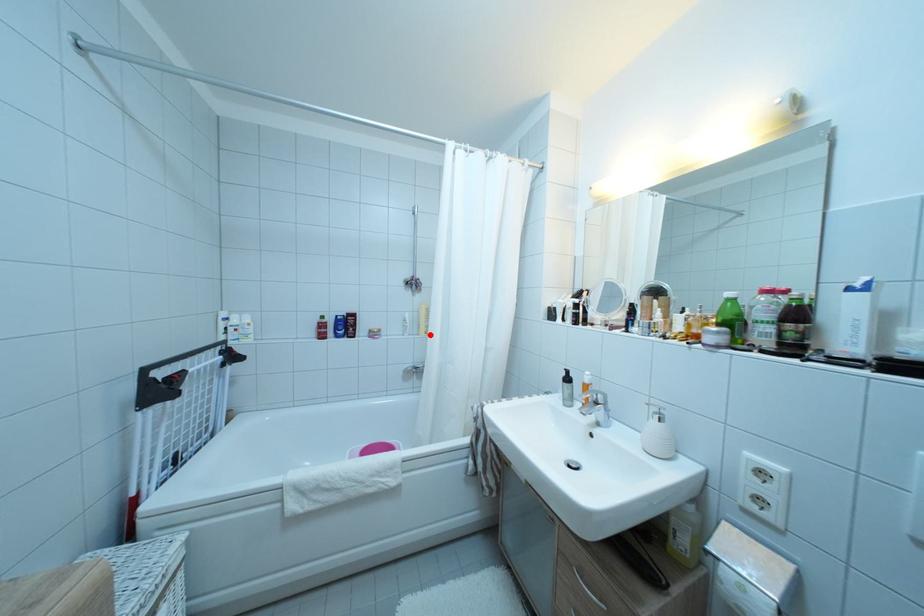
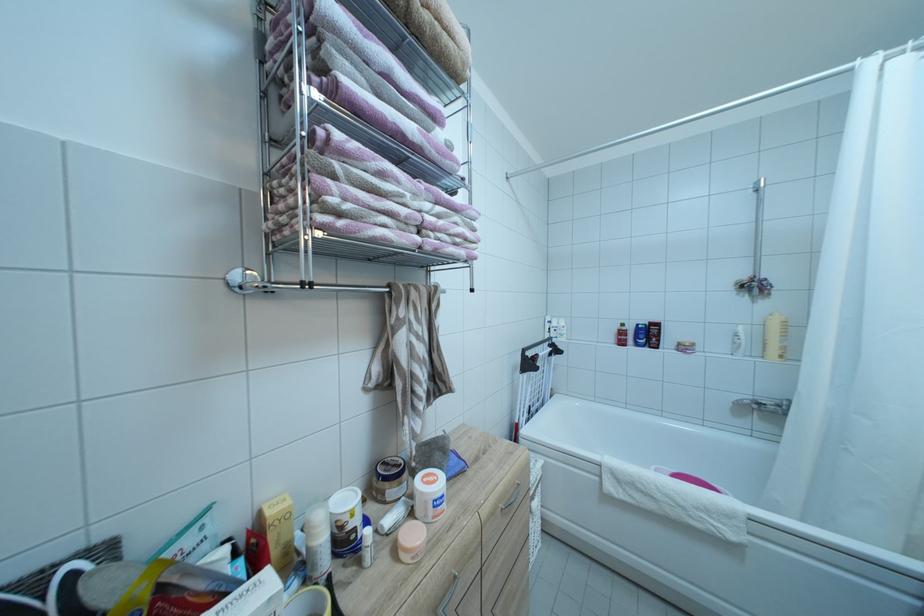
In the second image, find the point that corresponds to the highlighted location in the first image.

(781, 357)